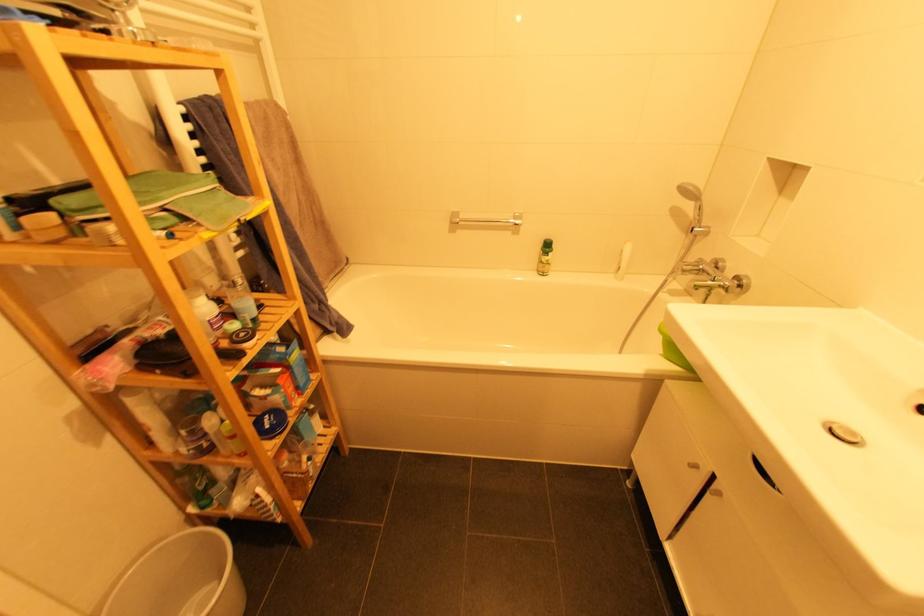
In order to click on metal towel rack in this screenshot , I will do `click(485, 220)`.